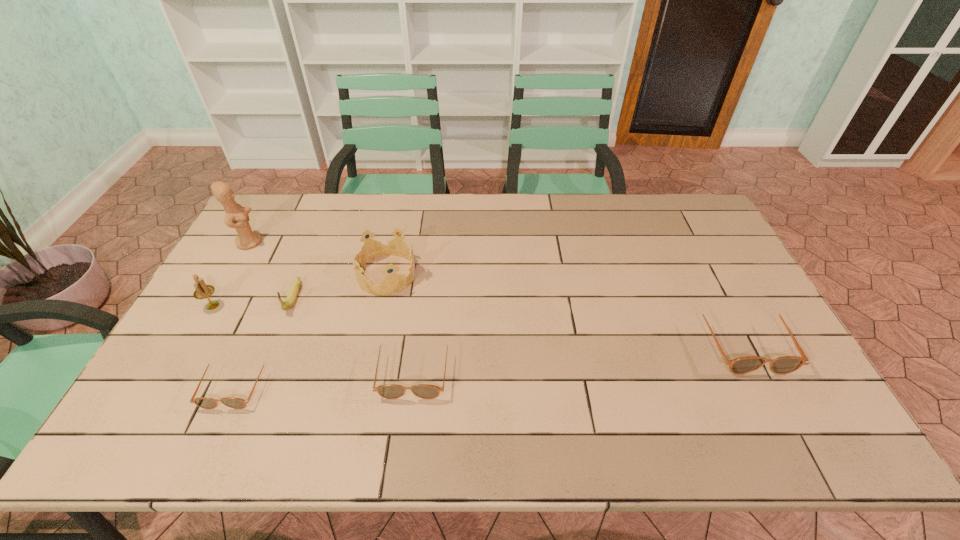
Identify the location of candle holder. (203, 291).

The image size is (960, 540). I want to click on free space located 0.070m on the front-facing side of the tallest sunglasses, so click(773, 400).

Where is `vacant area situated 0.240m on the front-facing side of the tiara`? The height and width of the screenshot is (540, 960). vacant area situated 0.240m on the front-facing side of the tiara is located at coordinates (492, 274).

Where is `free space located 0.370m on the front-facing side of the tallest object`? Image resolution: width=960 pixels, height=540 pixels. free space located 0.370m on the front-facing side of the tallest object is located at coordinates (372, 242).

Where is `blank space located 0.250m at the stem of the banana`? blank space located 0.250m at the stem of the banana is located at coordinates (254, 394).

Locate an element on the screen. vacant space located 0.070m on the back of the candle holder is located at coordinates (227, 282).

Where is `object at the far edge`? This screenshot has width=960, height=540. object at the far edge is located at coordinates (237, 217).

What are the coordinates of `sunglasses situated at the left edge` in the screenshot? It's located at (203, 402).

Find the location of `figurine located in the left edge section of the desktop`. figurine located in the left edge section of the desktop is located at coordinates (237, 217).

At what (x,y) coordinates should I click in order to perform the action: click on candle holder that is at the left edge. Please return your answer as a coordinate pair (x, y). This screenshot has height=540, width=960. Looking at the image, I should click on (203, 291).